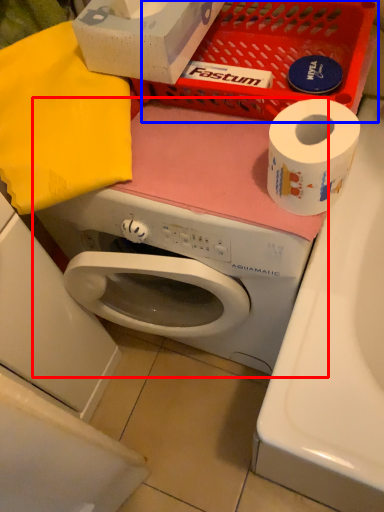
Question: Which object is closer to the camera taking this photo, washing machine (highlighted by a red box) or basket (highlighted by a blue box)?

Choices:
 (A) washing machine
 (B) basket

Answer: (A)